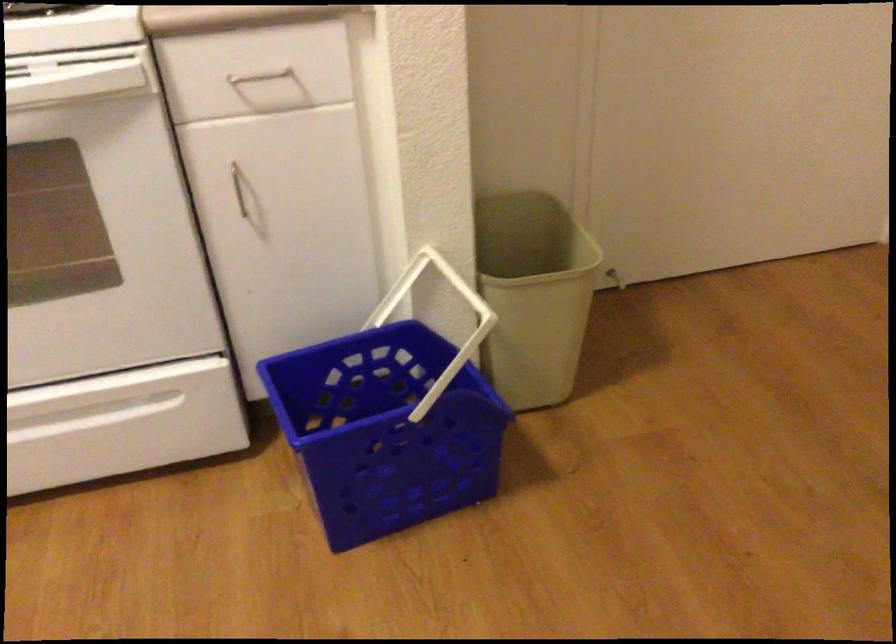
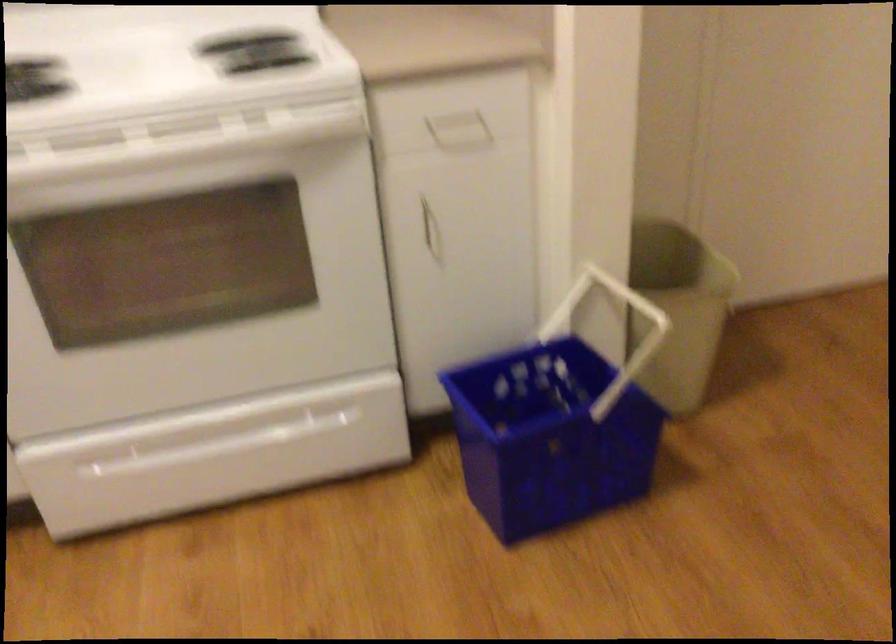
Find the pixel in the second image that matches (532,296) in the first image.

(678, 308)